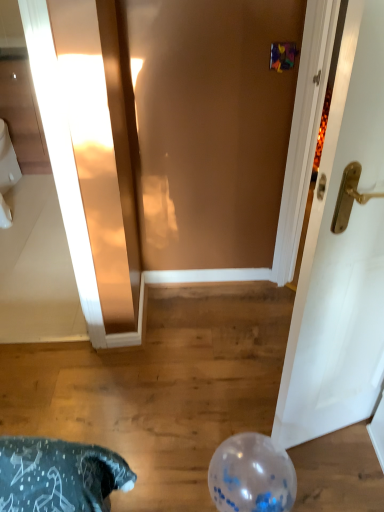
Question: Looking at their shapes, would you say white glossy toilet bowl at left is wider or thinner than transparent plastic balloon at lower center?

Choices:
 (A) thin
 (B) wide

Answer: (B)

Question: From the image's perspective, is white glossy toilet bowl at left above or below transparent plastic balloon at lower center?

Choices:
 (A) above
 (B) below

Answer: (A)

Question: Is white glossy toilet bowl at left bigger or smaller than transparent plastic balloon at lower center?

Choices:
 (A) big
 (B) small

Answer: (A)

Question: Considering the positions of transparent plastic balloon at lower center and white glossy toilet bowl at left in the image, is transparent plastic balloon at lower center bigger or smaller than white glossy toilet bowl at left?

Choices:
 (A) small
 (B) big

Answer: (A)

Question: From a real-world perspective, relative to white glossy toilet bowl at left, is transparent plastic balloon at lower center vertically above or below?

Choices:
 (A) below
 (B) above

Answer: (A)

Question: Is transparent plastic balloon at lower center wider or thinner than white glossy toilet bowl at left?

Choices:
 (A) thin
 (B) wide

Answer: (A)

Question: Is point (228, 508) positioned closer to the camera than point (11, 165)?

Choices:
 (A) closer
 (B) farther

Answer: (A)